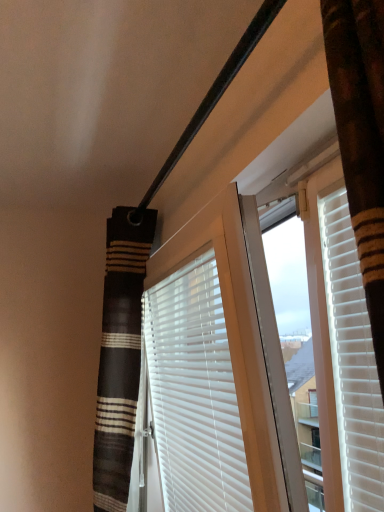
Question: Is striped fabric shower curtain at left positioned with its back to white matte blinds at center?

Choices:
 (A) yes
 (B) no

Answer: (B)

Question: Is striped fabric shower curtain at left not near white matte blinds at center?

Choices:
 (A) yes
 (B) no

Answer: (B)

Question: Is striped fabric shower curtain at left to the left of white matte blinds at center from the viewer's perspective?

Choices:
 (A) no
 (B) yes

Answer: (B)

Question: From the image's perspective, is striped fabric shower curtain at left below white matte blinds at center?

Choices:
 (A) no
 (B) yes

Answer: (B)

Question: Is striped fabric shower curtain at left behind white matte blinds at center?

Choices:
 (A) yes
 (B) no

Answer: (A)

Question: Is striped fabric shower curtain at left in front of white matte blinds at center?

Choices:
 (A) no
 (B) yes

Answer: (A)

Question: From a real-world perspective, is white matte blinds at center over striped fabric shower curtain at left?

Choices:
 (A) no
 (B) yes

Answer: (A)

Question: Does white matte blinds at center have a lesser height compared to striped fabric shower curtain at left?

Choices:
 (A) no
 (B) yes

Answer: (B)

Question: Can you confirm if white matte blinds at center is taller than striped fabric shower curtain at left?

Choices:
 (A) no
 (B) yes

Answer: (A)

Question: Can you confirm if white matte blinds at center is thinner than striped fabric shower curtain at left?

Choices:
 (A) yes
 (B) no

Answer: (A)

Question: Does white matte blinds at center touch striped fabric shower curtain at left?

Choices:
 (A) no
 (B) yes

Answer: (A)

Question: Considering the relative sizes of white matte blinds at center and striped fabric shower curtain at left in the image provided, is white matte blinds at center bigger than striped fabric shower curtain at left?

Choices:
 (A) no
 (B) yes

Answer: (A)

Question: Considering the positions of striped fabric shower curtain at left and white matte blinds at center in the image, is striped fabric shower curtain at left wider or thinner than white matte blinds at center?

Choices:
 (A) wide
 (B) thin

Answer: (A)